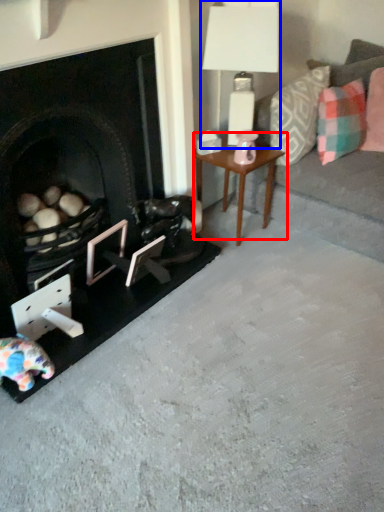
Question: Which of the following is the closest to the observer, table (highlighted by a red box) or table lamp (highlighted by a blue box)?

Choices:
 (A) table
 (B) table lamp

Answer: (B)